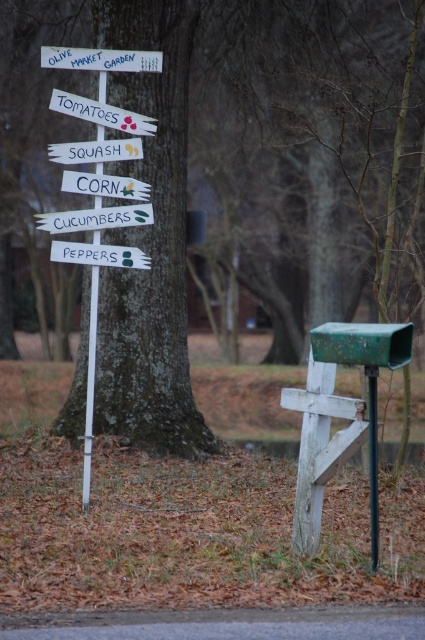
Locate an element on the screen. The image size is (425, 640). green bark tree at center is located at coordinates (244, 182).

Where is `green bark tree at center`? The height and width of the screenshot is (640, 425). green bark tree at center is located at coordinates (244, 182).

You are a GUI agent. You are given a task and a screenshot of the screen. Output one action in this format:
    pyautogui.click(x=<x>, y=<y>)
    Task: Click on the green bark tree at center
    
    Given the screenshot: What is the action you would take?
    pyautogui.click(x=244, y=182)

Does white paper sign at upper center appear on the left side of black plastic pole at center?

Indeed, white paper sign at upper center is positioned on the left side of black plastic pole at center.

You are a GUI agent. You are given a task and a screenshot of the screen. Output one action in this format:
    pyautogui.click(x=<x>, y=<y>)
    Task: Click on the white paper sign at upper center
    Image resolution: width=425 pixels, height=640 pixels.
    Given the screenshot: What is the action you would take?
    pyautogui.click(x=96, y=150)

Is brown rough tree trunk at center closer to camera compared to black plastic pole at center?

No, it is behind black plastic pole at center.

Does brown rough tree trunk at center appear on the left side of black plastic pole at center?

Indeed, brown rough tree trunk at center is positioned on the left side of black plastic pole at center.

You are a GUI agent. You are given a task and a screenshot of the screen. Output one action in this format:
    pyautogui.click(x=<x>, y=<y>)
    Task: Click on the brown rough tree trunk at center
    
    Given the screenshot: What is the action you would take?
    pyautogui.click(x=150, y=244)